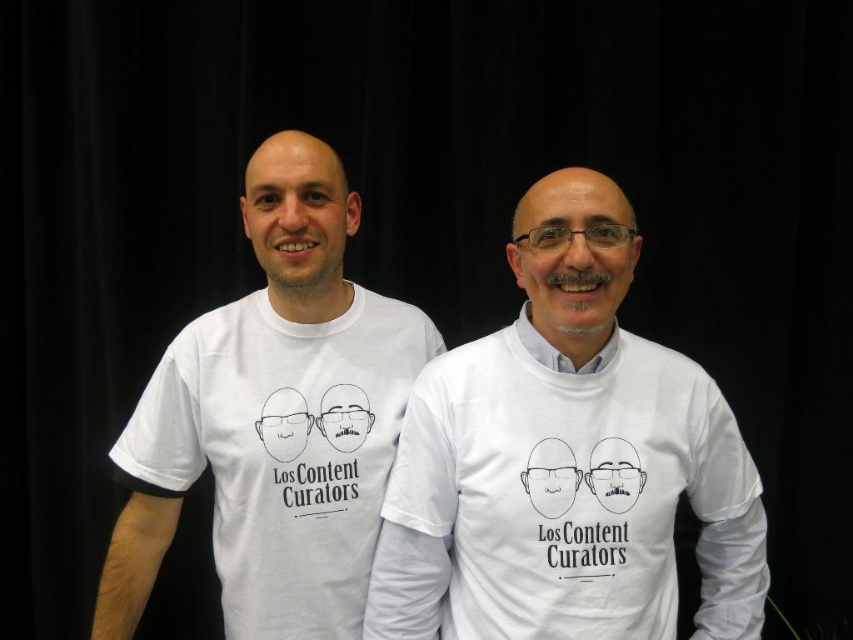
From the picture: Can you confirm if white cotton t-shirt at center is positioned to the left of white t-shirt at left?

No, white cotton t-shirt at center is not to the left of white t-shirt at left.

Is point (695, 464) closer to viewer compared to point (163, 412)?

Yes, point (695, 464) is in front of point (163, 412).

You are a GUI agent. You are given a task and a screenshot of the screen. Output one action in this format:
    pyautogui.click(x=<x>, y=<y>)
    Task: Click on the white cotton t-shirt at center
    This screenshot has height=640, width=853.
    Given the screenshot: What is the action you would take?
    pyautogui.click(x=566, y=460)